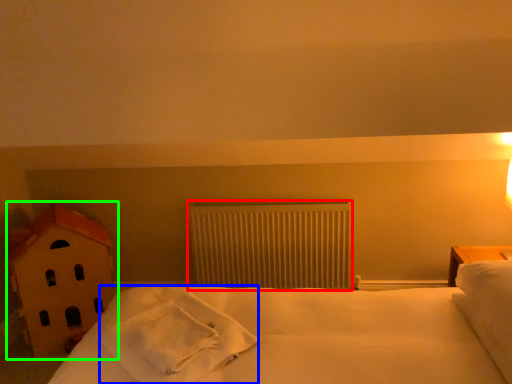
Question: Which is nearer to the radiator (highlighted by a red box)? material (highlighted by a blue box) or toy (highlighted by a green box).

Choices:
 (A) material
 (B) toy

Answer: (B)